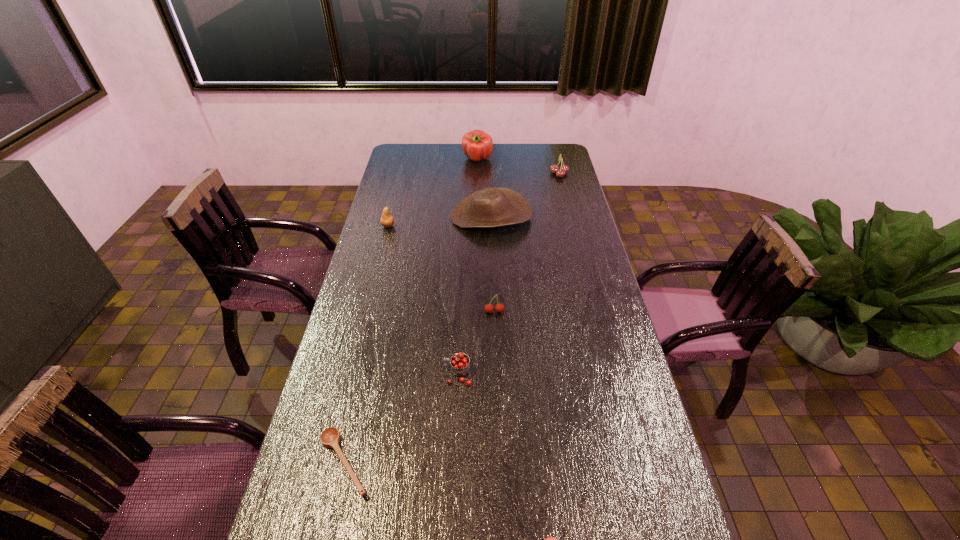
Locate an element on the screen. Image resolution: width=960 pixels, height=540 pixels. the farthest object is located at coordinates click(477, 145).

This screenshot has width=960, height=540. Find the location of `the tallest object`. the tallest object is located at coordinates (477, 145).

Where is `cowboy hat`? The image size is (960, 540). cowboy hat is located at coordinates (491, 207).

The height and width of the screenshot is (540, 960). Identify the location of pear. (387, 220).

The height and width of the screenshot is (540, 960). I want to click on the rightmost object, so click(x=560, y=173).

Identify the location of the rightmost cherry. (560, 173).

The image size is (960, 540). Find the location of `the leftmost cherry`. the leftmost cherry is located at coordinates (459, 364).

At what (x,y) coordinates should I click in order to perform the action: click on the sixth farthest object. Please return your answer as a coordinate pair (x, y). The height and width of the screenshot is (540, 960). Looking at the image, I should click on (459, 364).

Identify the location of the fourth nearest object. (488, 308).

The height and width of the screenshot is (540, 960). I want to click on the third nearest cherry, so click(488, 308).